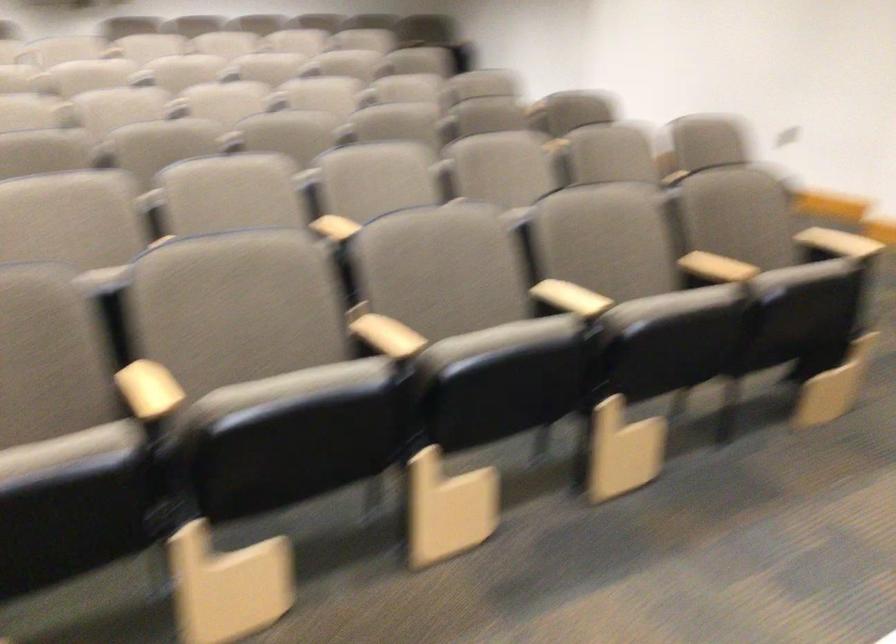
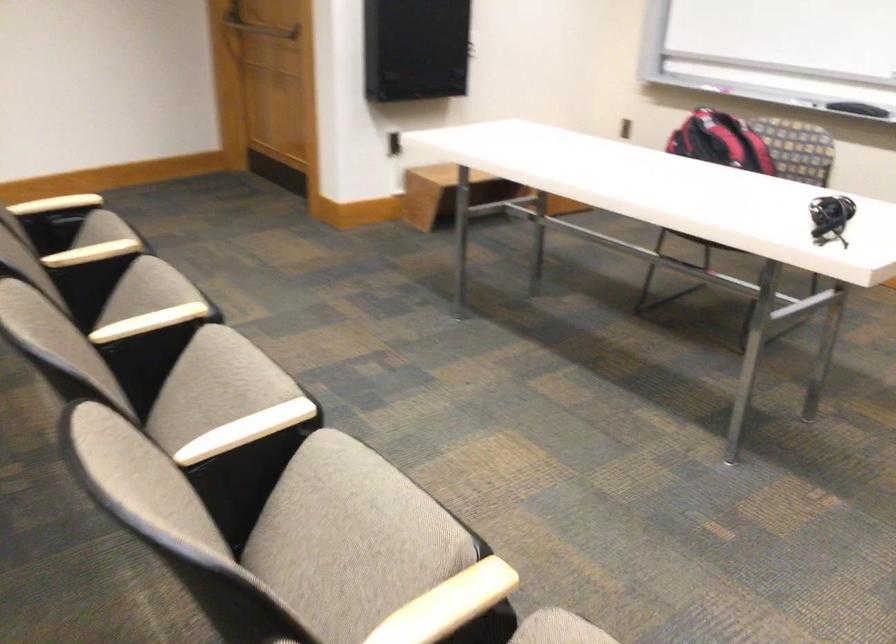
Locate, in the second image, the point that corresponds to point 709,267 in the first image.

(92, 252)